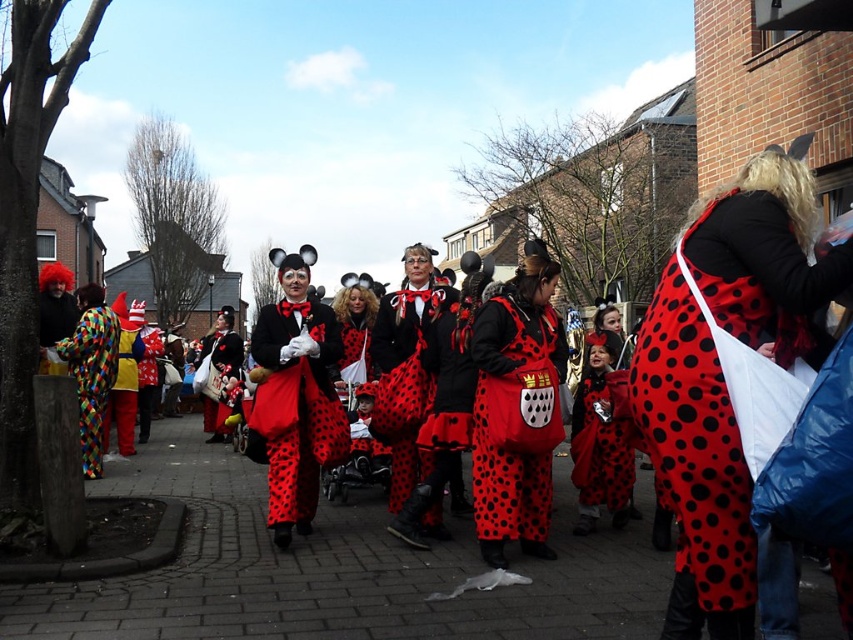
Based on the photo, you are a photographer positioned at the back of the crowd. You want to take a photo of both the matte black coat at center and the matte yellow clown suit at left. However, you can only focus on one subject at a time. Which subject should you focus on first to ensure it appears sharp in the photo?

You should focus on the matte black coat at center first because it is closer to you than the matte yellow clown suit at left, so focusing on it will keep it sharp while the clown suit may appear slightly blurred. Alternatively, focus on a point between them to capture both in focus.

From the picture: You are an event organizer who needs to arrange seating for two performers. The first performer is wearing the matte black coat at center, and the second is in the matte yellow clown suit at left. Given their costume sizes, which performer requires a larger seat?

The matte yellow clown suit at left requires a larger seat because it is bigger than the matte black coat at center.

Based on the photo, you are a photographer trying to capture both the red dotted fabric dress at center and the matte yellow clown suit at left in a single shot. However, your camera can only focus on one subject at a time. Based on their positions, which subject should you focus on to ensure the other remains in the background?

The red dotted fabric dress at center is positioned over the matte yellow clown suit at left, so focusing on the red dotted fabric dress at center will keep the matte yellow clown suit at left in the background.